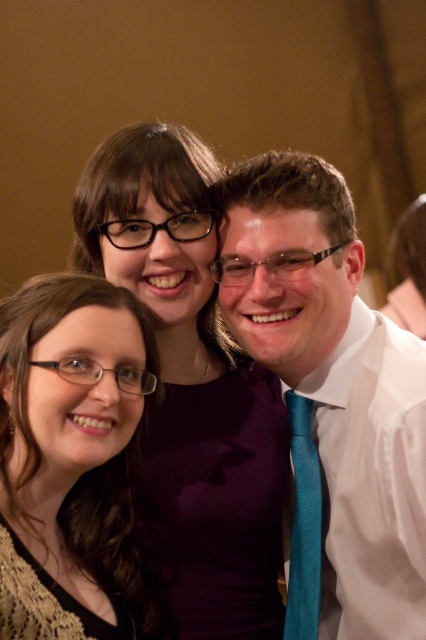
I want to click on purple fabric dress at center, so click(190, 388).

Does point (176, 532) come in front of point (294, 433)?

That is True.

Locate an element on the screen. purple fabric dress at center is located at coordinates (190, 388).

This screenshot has height=640, width=426. Find the location of `purple fabric dress at center`. purple fabric dress at center is located at coordinates (190, 388).

Is white glossy shirt at center bigger than purple fabric dress at center?

Actually, white glossy shirt at center might be smaller than purple fabric dress at center.

Is white glossy shirt at center positioned behind purple fabric dress at center?

No.

Is point (226, 289) positioned before point (184, 628)?

Yes, it is.

The height and width of the screenshot is (640, 426). What are the coordinates of `white glossy shirt at center` in the screenshot? It's located at (331, 396).

Can you confirm if purple fabric dress at center is wider than matte black glasses at lower left?

Yes.

Can you confirm if purple fabric dress at center is smaller than matte black glasses at lower left?

No.

You are a GUI agent. You are given a task and a screenshot of the screen. Output one action in this format:
    pyautogui.click(x=<x>, y=<y>)
    Task: Click on the purple fabric dress at center
    The width and height of the screenshot is (426, 640).
    Given the screenshot: What is the action you would take?
    pyautogui.click(x=190, y=388)